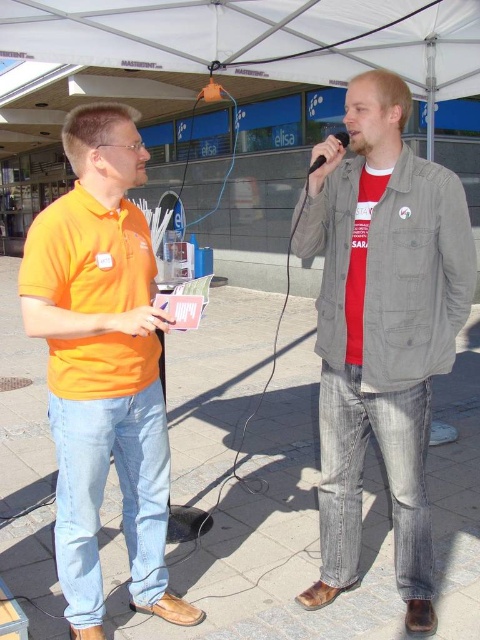
Which is behind, point (357, 180) or point (345, 132)?

The point (345, 132) is behind.

Is red cotton t-shirt at center closer to camera compared to black matte microphone at center?

Yes, it is.

Between point (445, 182) and point (335, 132), which one is positioned behind?

Positioned behind is point (335, 132).

At what (x,y) coordinates should I click in order to perform the action: click on red cotton t-shirt at center. Please return your answer as a coordinate pair (x, y). The image size is (480, 640). Looking at the image, I should click on (382, 328).

Who is shorter, red cotton t-shirt at center or orange cotton shirt at left?

orange cotton shirt at left

Does red cotton t-shirt at center appear over orange cotton shirt at left?

Correct, red cotton t-shirt at center is located above orange cotton shirt at left.

Which is in front, point (348, 358) or point (166, 582)?

Positioned in front is point (348, 358).

Find the location of a particular element. The image size is (480, 640). red cotton t-shirt at center is located at coordinates (382, 328).

What do you see at coordinates (103, 365) in the screenshot?
I see `orange cotton shirt at left` at bounding box center [103, 365].

Is orange cotton shirt at left positioned in front of white fabric canopy at upper center?

Yes.

Which is in front, point (144, 360) or point (241, 24)?

Point (144, 360) is more forward.

This screenshot has width=480, height=640. In order to click on orange cotton shirt at left in this screenshot , I will do `click(103, 365)`.